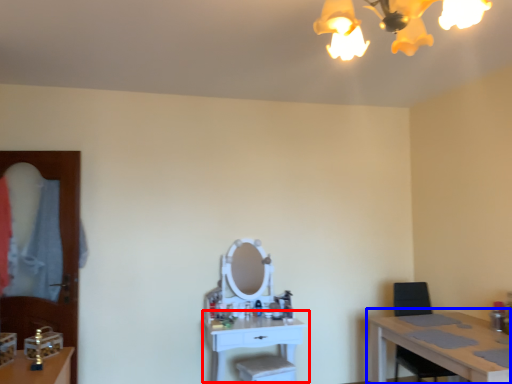
Question: Which of the following is the closest to the observer, table (highlighted by a red box) or table (highlighted by a blue box)?

Choices:
 (A) table
 (B) table

Answer: (B)